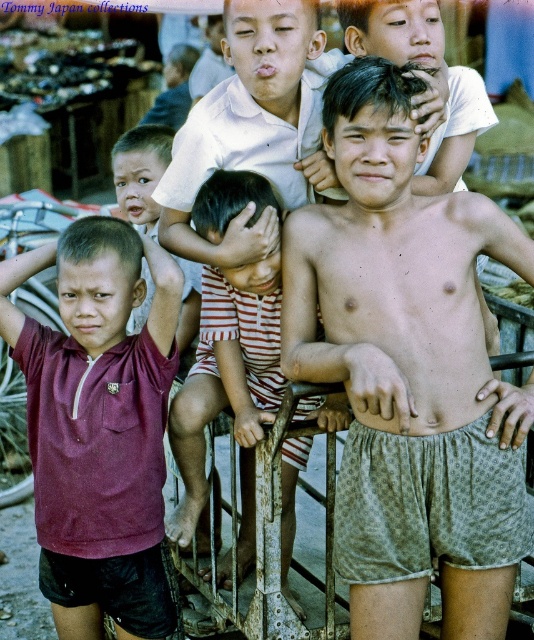
In the scene described, there are two boys wearing patterned cotton shorts at center and striped cotton romper at center. Which of these two items of clothing is positioned to the right of the other?

The patterned cotton shorts at center are to the right of the striped cotton romper at center.

You are a photographer trying to capture a closeup of the patterned cotton shorts at center. Based on their position in the image, what coordinates should you focus on to ensure the shorts are in the center of your viewfinder?

The patterned cotton shorts at center are located at coordinates point (409, 371), so focusing there will center them in the viewfinder.